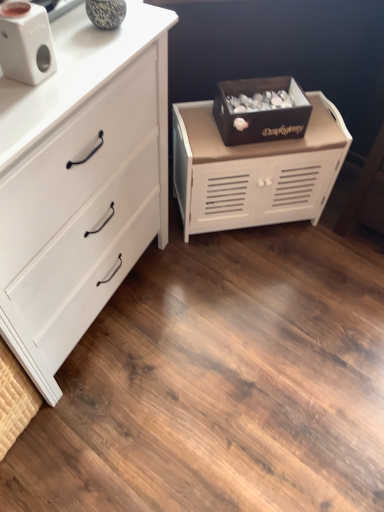
Question: Is white matte chest of drawers at left, arranged as the second chest of drawers when viewed from the right, closer to camera compared to white matte cabinet at center, which is the first chest of drawers from right to left?

Choices:
 (A) yes
 (B) no

Answer: (A)

Question: Could you tell me if white matte chest of drawers at left, arranged as the second chest of drawers when viewed from the right, is facing white matte cabinet at center, which is the first chest of drawers from right to left?

Choices:
 (A) yes
 (B) no

Answer: (B)

Question: From a real-world perspective, is white matte chest of drawers at left, the first chest of drawers from the left, on top of white matte cabinet at center, the 2th chest of drawers from the left?

Choices:
 (A) yes
 (B) no

Answer: (A)

Question: Is white matte chest of drawers at left, the first chest of drawers from the left, behind white matte cabinet at center, the 2th chest of drawers from the left?

Choices:
 (A) no
 (B) yes

Answer: (A)

Question: Does white matte chest of drawers at left, the first chest of drawers from the left, have a greater width compared to white matte cabinet at center, which is the first chest of drawers from right to left?

Choices:
 (A) no
 (B) yes

Answer: (B)

Question: Can you confirm if white matte chest of drawers at left, the first chest of drawers from the left, is shorter than white matte cabinet at center, the 2th chest of drawers from the left?

Choices:
 (A) no
 (B) yes

Answer: (A)

Question: Is white matte cabinet at center, the 2th chest of drawers from the left, thinner than white matte chest of drawers at left, arranged as the second chest of drawers when viewed from the right?

Choices:
 (A) no
 (B) yes

Answer: (B)

Question: Does white matte cabinet at center, the 2th chest of drawers from the left, have a smaller size compared to white matte chest of drawers at left, arranged as the second chest of drawers when viewed from the right?

Choices:
 (A) yes
 (B) no

Answer: (A)

Question: Is the depth of white matte cabinet at center, which is the first chest of drawers from right to left, less than that of white matte chest of drawers at left, the first chest of drawers from the left?

Choices:
 (A) yes
 (B) no

Answer: (B)

Question: Does white matte cabinet at center, which is the first chest of drawers from right to left, have a greater height compared to white matte chest of drawers at left, the first chest of drawers from the left?

Choices:
 (A) no
 (B) yes

Answer: (A)

Question: Is white matte cabinet at center, the 2th chest of drawers from the left, directly adjacent to white matte chest of drawers at left, arranged as the second chest of drawers when viewed from the right?

Choices:
 (A) no
 (B) yes

Answer: (A)

Question: Is white matte cabinet at center, which is the first chest of drawers from right to left, shorter than white matte chest of drawers at left, the first chest of drawers from the left?

Choices:
 (A) yes
 (B) no

Answer: (A)

Question: Does dark brown wooden box at center have a greater width compared to white matte speaker at upper left?

Choices:
 (A) yes
 (B) no

Answer: (A)